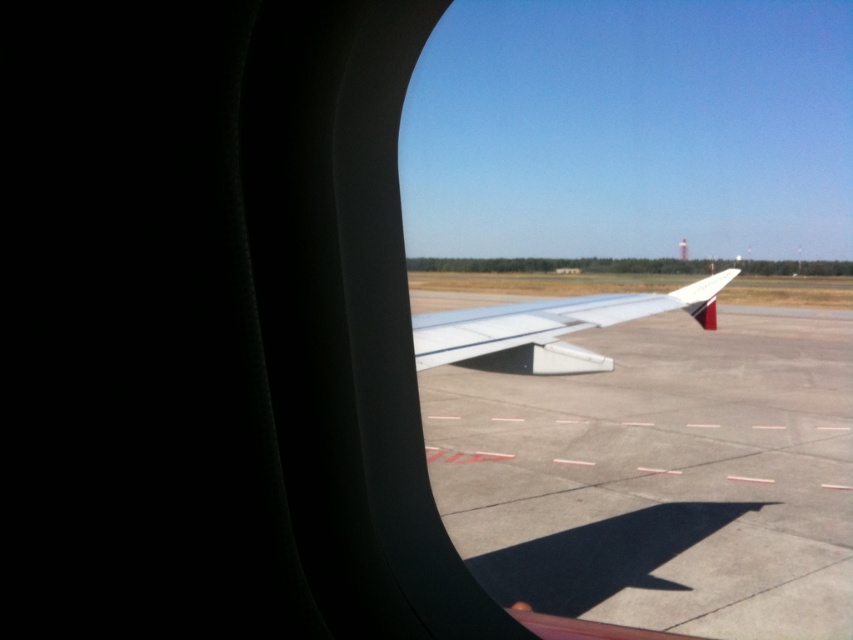
You are a flight attendant checking the landing gear status from the airplane window. You notice the smooth concrete tarmac at center and the white matte wing at center. Which object appears bigger in the view?

The smooth concrete tarmac at center has a larger size compared to the white matte wing at center, so the smooth concrete tarmac at center appears bigger in the view.

In the scene shown: You are a passenger sitting in the airplane and looking out the window. You see the smooth concrete tarmac at center and the white matte wing at center. Which object is closer to you?

The smooth concrete tarmac at center is closer to the viewer than the white matte wing at center.

You are a maintenance worker standing on the smooth concrete tarmac at center. You need to reach the white matte wing at center to inspect a potential issue. Given that your ladder is 10 meters long, can you safely reach the wing from your current position on the tarmac without moving the ladder?

The distance between the smooth concrete tarmac at center and the white matte wing at center is 10.19 meters. Since the ladder is only 10 meters long, it is 0.19 meters shorter than required. Therefore, you cannot safely reach the wing without moving the ladder closer.